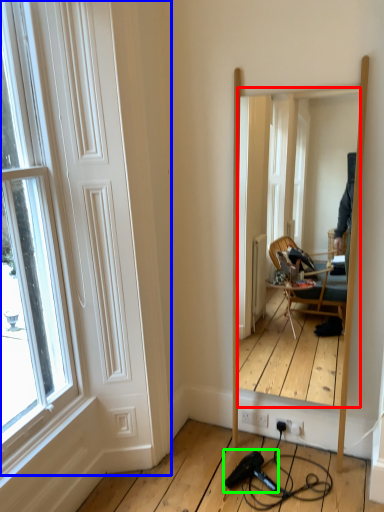
Question: Estimate the real-world distances between objects in this image. Which object is closer to mirror (highlighted by a red box), door (highlighted by a blue box) or hair drier (highlighted by a green box)?

Choices:
 (A) door
 (B) hair drier

Answer: (A)